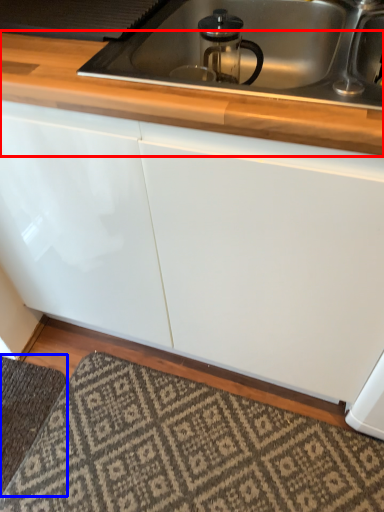
Question: Which of the following is the farthest to the observer, countertop (highlighted by a red box) or doormat (highlighted by a blue box)?

Choices:
 (A) countertop
 (B) doormat

Answer: (B)